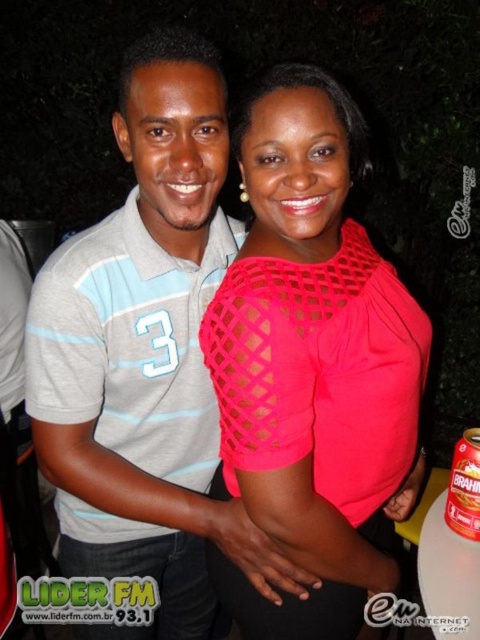
You are a photographer adjusting the focus on your camera. You want to ensure both the bright pink mesh top at center and the gray striped polo shirt at center are in focus. Based on their positions, which one should you focus on first to achieve proper depth of field?

The bright pink mesh top at center is closer to the viewer than the gray striped polo shirt at center. To achieve proper depth of field, focus on the bright pink mesh top at center first since it is closer, then adjust to ensure the gray striped polo shirt at center is also in focus.

You are a photographer setting up for a night shoot. You have a gray striped polo shirt at center and a brown cardboard can at lower right in your frame. Which object should you focus on first if you want to capture the larger item in your shot?

The gray striped polo shirt at center is bigger than the brown cardboard can at lower right, so you should focus on the gray striped polo shirt at center first to capture the larger item.